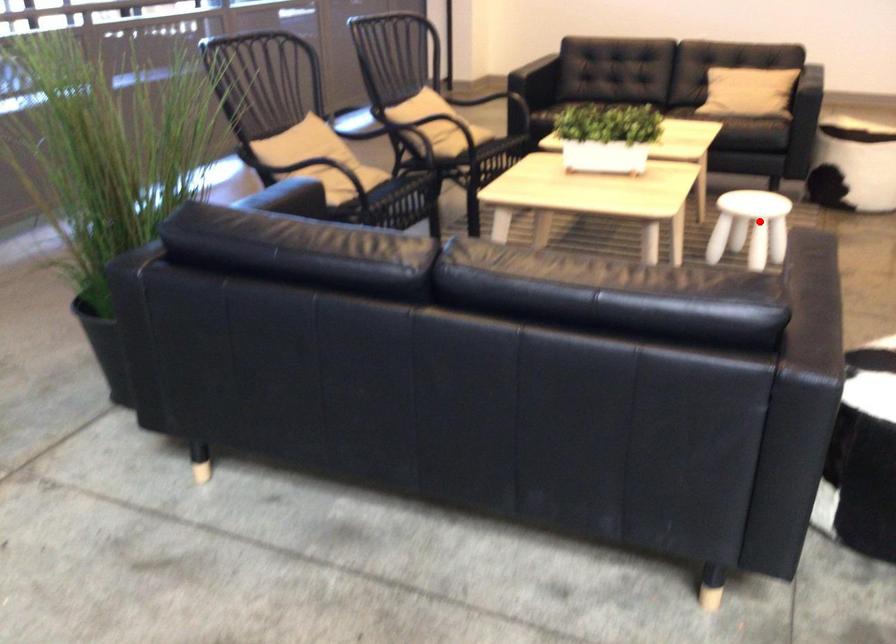
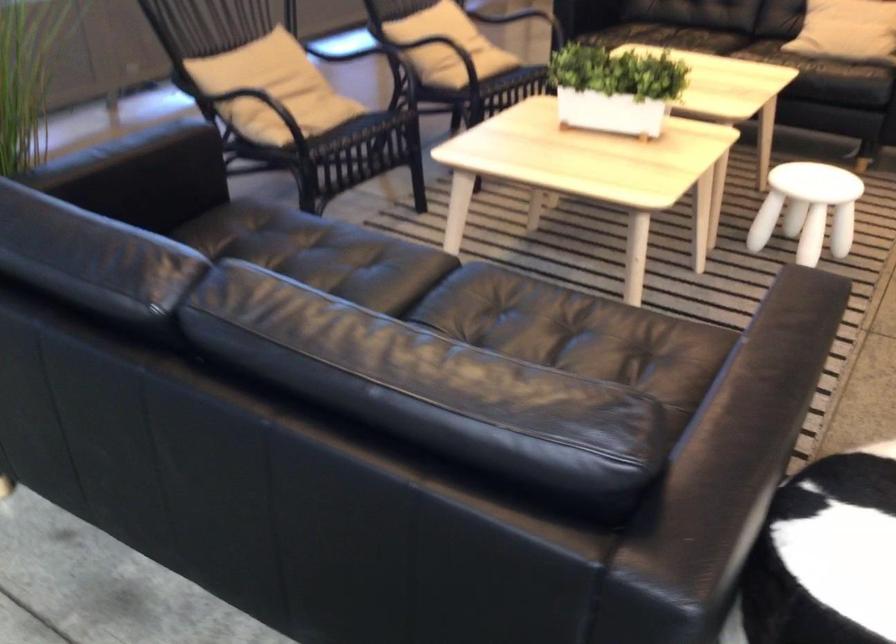
Question: I am providing you with two images of the same scene from different viewpoints. A red point is shown in image1. For the corresponding object point in image2, is it positioned nearer or farther from the camera?

Choices:
 (A) Nearer
 (B) Farther

Answer: (A)